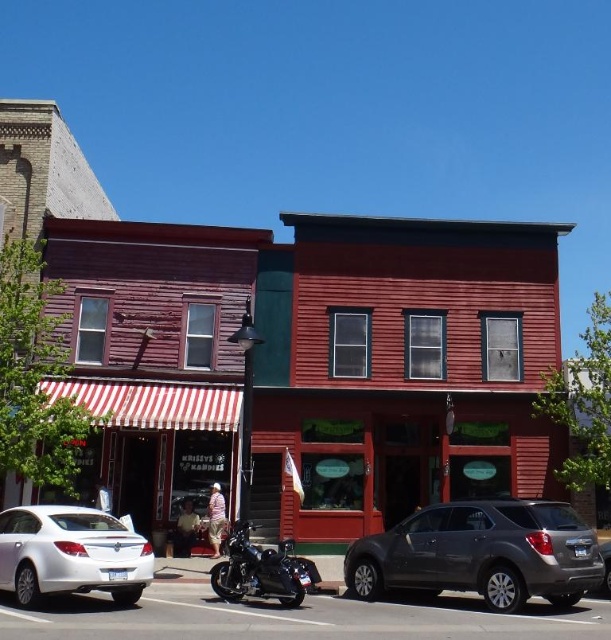
Question: Estimate the real-world distances between objects in this image. Which object is farther from the metallic silver car at center?

Choices:
 (A) red wood building at center
 (B) black matte motorcycle at center

Answer: (B)

Question: Does white glossy sedan at lower left come in front of metallic silver car at center?

Choices:
 (A) yes
 (B) no

Answer: (A)

Question: Can you confirm if black matte motorcycle at center is positioned to the right of metallic silver car at center?

Choices:
 (A) no
 (B) yes

Answer: (B)

Question: Which point is farther to the camera?

Choices:
 (A) (535, 300)
 (B) (191, 508)
 (C) (609, 548)
 (D) (16, 541)

Answer: (A)

Question: Among these objects, which one is nearest to the camera?

Choices:
 (A) matte gray suv at center
 (B) black matte motorcycle at center

Answer: (B)

Question: Is the position of red wood building at center more distant than that of metallic silver car at center?

Choices:
 (A) no
 (B) yes

Answer: (A)